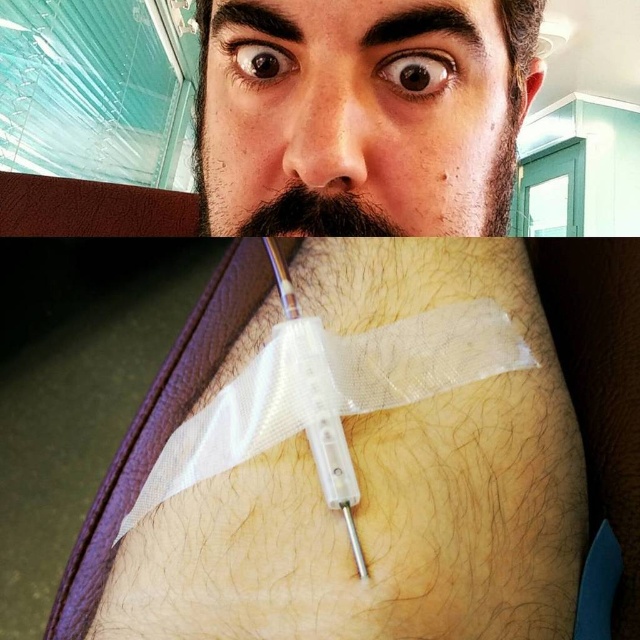
At what (x,y) coordinates should I click in order to perform the action: click on brown fuzzy beard at upper center. Please return your answer as a coordinate pair (x, y). The width and height of the screenshot is (640, 640). Looking at the image, I should click on (316, 216).

Does brown fuzzy beard at upper center have a greater width compared to transparent plastic syringe at center?

Yes.

Is point (305, 196) more distant than point (321, 472)?

That is True.

In order to click on brown fuzzy beard at upper center in this screenshot , I will do `click(316, 216)`.

Is matte black face at upper center taller than transparent plastic syringe at center?

Correct, matte black face at upper center is much taller as transparent plastic syringe at center.

Is matte black face at upper center closer to the viewer compared to transparent plastic syringe at center?

No, it is behind transparent plastic syringe at center.

Where is `matte black face at upper center`? matte black face at upper center is located at coordinates point(362,115).

Can you confirm if hair-covered skin at center is positioned to the right of matte black face at upper center?

No, hair-covered skin at center is not to the right of matte black face at upper center.

Which is above, hair-covered skin at center or matte black face at upper center?

matte black face at upper center is higher up.

Does point (445, 397) lie in front of point (305, 145)?

Yes, it is in front of point (305, 145).

Locate an element on the screen. This screenshot has width=640, height=640. hair-covered skin at center is located at coordinates (384, 490).